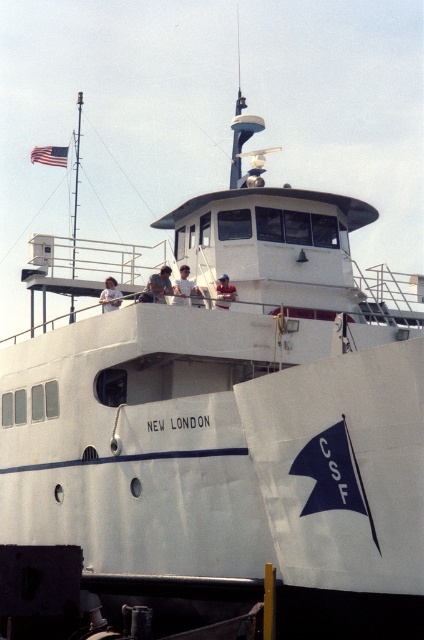
You are on the deck of the ship and see the matte skin person at center and the white matte shirt at center. Which object is located above the other?

The matte skin person at center is positioned over white matte shirt at center.

You are on the deck of the NEW LONDON ship and want to hand a light brown wooden stick at center to a matte skin person at center. Can you reach them directly without moving from your current position?

The matte skin person at center is closer to the viewer than the light brown wooden stick at center, so you can reach them directly without moving because the person is in front of the stick.